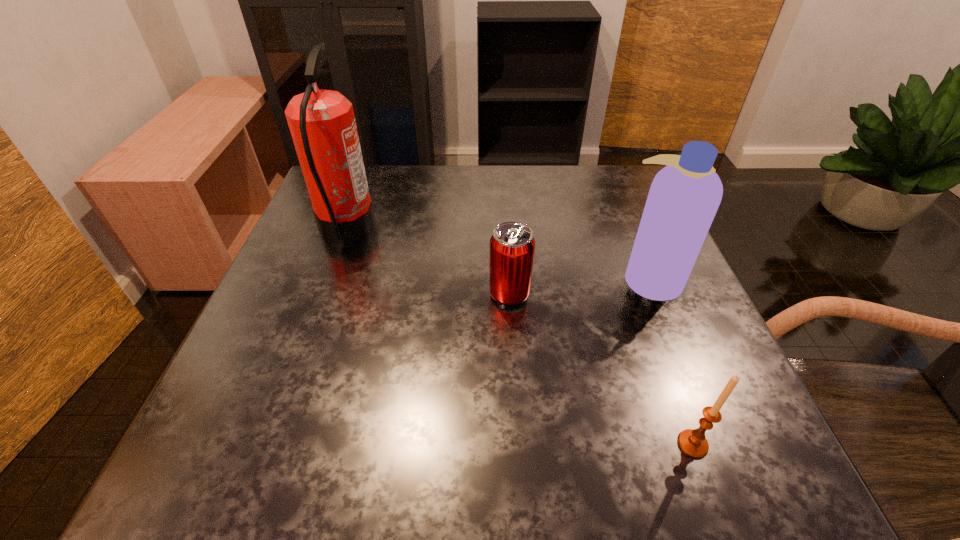
The image size is (960, 540). I want to click on vacant space that satisfies the following two spatial constraints: 1. on the back side of the nearest object; 2. on the front side of the fire extinguisher, so click(x=614, y=231).

Find the location of a particular element. Image resolution: width=960 pixels, height=540 pixels. free space in the image that satisfies the following two spatial constraints: 1. on the front side of the tallest object; 2. on the back side of the third shortest object is located at coordinates (329, 279).

Identify the location of free spot that satisfies the following two spatial constraints: 1. on the front side of the third object from right to left; 2. on the right side of the tallest object. (324, 294).

Locate an element on the screen. Image resolution: width=960 pixels, height=540 pixels. free location that satisfies the following two spatial constraints: 1. on the back side of the second tallest object; 2. on the right side of the third object from right to left is located at coordinates (509, 279).

Where is `free region that satisfies the following two spatial constraints: 1. on the back side of the third object from right to left; 2. on the front side of the tallest object`? This screenshot has width=960, height=540. free region that satisfies the following two spatial constraints: 1. on the back side of the third object from right to left; 2. on the front side of the tallest object is located at coordinates (505, 231).

Find the location of a particular element. free region that satisfies the following two spatial constraints: 1. on the front side of the nearest object; 2. on the right side of the second object from left to right is located at coordinates (519, 444).

Locate an element on the screen. The width and height of the screenshot is (960, 540). free region that satisfies the following two spatial constraints: 1. on the front side of the leftmost object; 2. on the right side of the candle_holder is located at coordinates (269, 444).

The height and width of the screenshot is (540, 960). I want to click on free location that satisfies the following two spatial constraints: 1. on the front side of the fire extinguisher; 2. on the left side of the candle_holder, so click(269, 444).

Locate an element on the screen. free space that satisfies the following two spatial constraints: 1. on the front side of the tallest object; 2. on the left side of the second tallest object is located at coordinates (329, 279).

Identify the location of free space that satisfies the following two spatial constraints: 1. on the front side of the nearest object; 2. on the left side of the fire extinguisher. The image size is (960, 540). (269, 444).